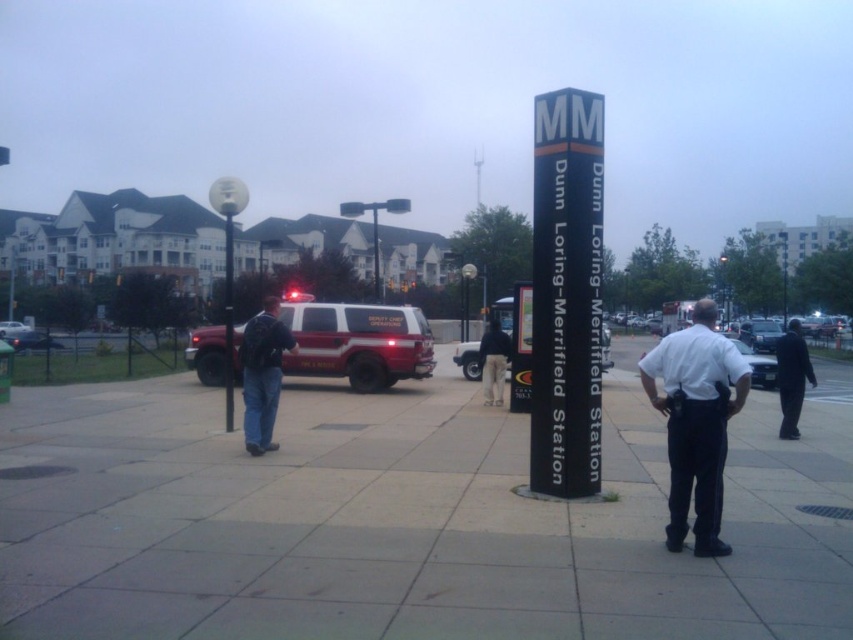
You are a pedestrian crossing the street and see the metallic silver sedan at center and the metallic silver car at left. Which vehicle is closer to you?

The metallic silver sedan at center is closer to you because it is positioned under the metallic silver car at left, indicating it is in front.

In the scene shown: You are a delivery person trying to park your delivery van, which is 2 meters wide, in the space between the smooth concrete pavement at center and the metallic silver car at left. Based on the scene, can your van fit there?

The smooth concrete pavement at center might be wider than the metallic silver car at left, so there is a possibility that the space between them could accommodate your 2 meter wide van. However, since the exact width isn not specified, you should measure the space before proceeding.

You are standing at the point marked by the coordinates point (404, 520) in the image. What is the type of surface you are standing on?

The surface at point (404, 520) is smooth concrete pavement.